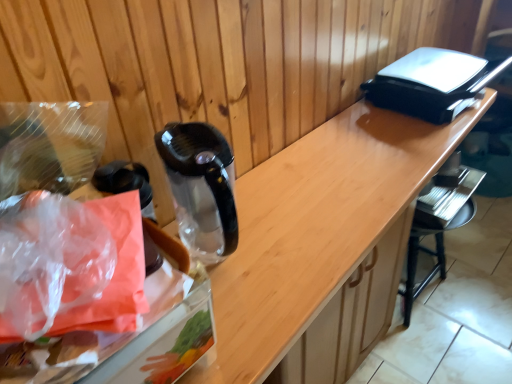
Where is `wooden counter at center`? The width and height of the screenshot is (512, 384). wooden counter at center is located at coordinates (324, 242).

Measure the distance between black plastic bar stool at lower right and camera.

1.28 meters.

The width and height of the screenshot is (512, 384). What are the coordinates of `transparent plastic bag at left` in the screenshot? It's located at 124,180.

From the image's perspective, which object appears higher, translucent plastic bag at left or black plastic bar stool at lower right?

translucent plastic bag at left.

You are a GUI agent. You are given a task and a screenshot of the screen. Output one action in this format:
    pyautogui.click(x=<x>, y=<y>)
    Task: Click on the bar stool that appears below the translucent plastic bag at left (from the image's perspective)
    Image resolution: width=512 pixels, height=384 pixels.
    Given the screenshot: What is the action you would take?
    pyautogui.click(x=438, y=227)

Could you tell me if translucent plastic bag at left is turned towards black plastic bar stool at lower right?

No, translucent plastic bag at left is not facing towards black plastic bar stool at lower right.

What's the angular difference between translucent plastic bag at left and wooden counter at center's facing directions?

translucent plastic bag at left and wooden counter at center are facing 6.14 degrees away from each other.

Which is correct: translucent plastic bag at left is inside wooden counter at center, or outside of it?

translucent plastic bag at left lies outside wooden counter at center.

From a real-world perspective, is translucent plastic bag at left positioned above or below wooden counter at center?

translucent plastic bag at left is above wooden counter at center.

How far apart are translucent plastic bag at left and transparent plastic bag at left?

The distance of translucent plastic bag at left from transparent plastic bag at left is 3.88 inches.

Is translucent plastic bag at left located outside transparent plastic bag at left?

Absolutely, translucent plastic bag at left is external to transparent plastic bag at left.

Is translucent plastic bag at left positioned before transparent plastic bag at left?

Yes, translucent plastic bag at left is in front of transparent plastic bag at left.

Is translucent plastic bag at left to the right of transparent plastic bag at left from the viewer's perspective?

Incorrect, translucent plastic bag at left is not on the right side of transparent plastic bag at left.

Measure the distance from black plastic bar stool at lower right to transparent plastic bag at left.

A distance of 1.05 meters exists between black plastic bar stool at lower right and transparent plastic bag at left.

Is there a large distance between black plastic bar stool at lower right and transparent plastic bag at left?

Indeed, black plastic bar stool at lower right is not near transparent plastic bag at left.

Looking at the image, does black plastic bar stool at lower right seem bigger or smaller compared to transparent plastic bag at left?

Considering their sizes, black plastic bar stool at lower right takes up more space than transparent plastic bag at left.

How different are the orientations of black plastic bar stool at lower right and transparent plastic bag at left in degrees?

black plastic bar stool at lower right and transparent plastic bag at left are facing 4 degrees away from each other.

Who is taller, transparent plastic bag at left or wooden counter at center?

With more height is wooden counter at center.

Which of these two, transparent plastic bag at left or wooden counter at center, is smaller?

With smaller size is transparent plastic bag at left.

Would you say transparent plastic bag at left is inside or outside wooden counter at center?

transparent plastic bag at left is not enclosed by wooden counter at center.

Locate an element on the screen. The width and height of the screenshot is (512, 384). plastic bag above the black plastic bar stool at lower right (from the image's perspective) is located at coordinates (70, 265).

From the image's perspective, is black plastic bar stool at lower right over translucent plastic bag at left?

Actually, black plastic bar stool at lower right appears below translucent plastic bag at left in the image.

Can you confirm if black plastic bar stool at lower right is taller than translucent plastic bag at left?

Correct, black plastic bar stool at lower right is much taller as translucent plastic bag at left.

Does black plastic bar stool at lower right have a smaller size compared to translucent plastic bag at left?

Actually, black plastic bar stool at lower right might be larger than translucent plastic bag at left.

Is point (367, 289) closer or farther from the camera than point (117, 173)?

Point (367, 289).

Locate an element on the screen. The image size is (512, 384). appliance behind the wooden counter at center is located at coordinates (124, 180).

What's the angular difference between wooden counter at center and transparent plastic bag at left's facing directions?

The angular difference between wooden counter at center and transparent plastic bag at left is 0.0637 degrees.

From a real-world perspective, is wooden counter at center below transparent plastic bag at left?

Yes, from a real-world perspective, wooden counter at center is below transparent plastic bag at left.

This screenshot has height=384, width=512. In order to click on plastic bag that appears in front of the black plastic bar stool at lower right in this screenshot , I will do `click(70, 265)`.

Where is `counter located behind the translucent plastic bag at left`? The image size is (512, 384). counter located behind the translucent plastic bag at left is located at coordinates pos(324,242).

Considering their positions, is transparent plastic bag at left positioned further to translucent plastic bag at left than wooden counter at center?

Based on the image, wooden counter at center appears to be further to translucent plastic bag at left.

When comparing their distances from wooden counter at center, does transparent plastic bag at left or translucent plastic bag at left seem closer?

The object closer to wooden counter at center is transparent plastic bag at left.

Estimate the real-world distances between objects in this image. Which object is further from transparent plastic bag at left, translucent plastic bag at left or black plastic bar stool at lower right?

black plastic bar stool at lower right is further to transparent plastic bag at left.

Looking at the image, which one is located closer to transparent plastic bag at left, wooden counter at center or translucent plastic bag at left?

translucent plastic bag at left is closer to transparent plastic bag at left.

Based on their spatial positions, is black plastic bar stool at lower right or transparent plastic bag at left further from translucent plastic bag at left?

black plastic bar stool at lower right is further to translucent plastic bag at left.

Considering their positions, is transparent plastic bag at left positioned closer to wooden counter at center than black plastic bar stool at lower right?

Among the two, black plastic bar stool at lower right is located nearer to wooden counter at center.

Looking at this image, based on their spatial positions, is wooden counter at center or transparent plastic bag at left closer to black plastic bar stool at lower right?

Among the two, wooden counter at center is located nearer to black plastic bar stool at lower right.

Based on their spatial positions, is black plastic bar stool at lower right or wooden counter at center closer to transparent plastic bag at left?

Among the two, wooden counter at center is located nearer to transparent plastic bag at left.

This screenshot has height=384, width=512. In order to click on appliance located between translucent plastic bag at left and black plastic bar stool at lower right in the left-right direction in this screenshot , I will do `click(124, 180)`.

I want to click on counter between translucent plastic bag at left and black plastic bar stool at lower right in the front-back direction, so click(324, 242).

Image resolution: width=512 pixels, height=384 pixels. I want to click on counter situated between transparent plastic bag at left and black plastic bar stool at lower right from left to right, so click(x=324, y=242).

Image resolution: width=512 pixels, height=384 pixels. In order to click on appliance located between translucent plastic bag at left and wooden counter at center in the left-right direction in this screenshot , I will do `click(124, 180)`.